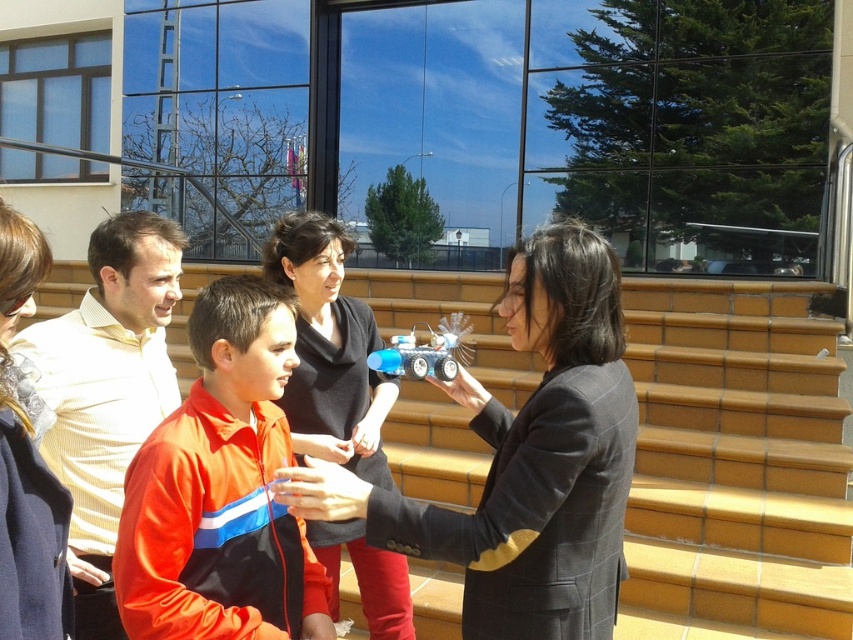
Based on the photo, you are a photographer trying to capture a photo of the yellow striped shirt at left and the black matte jacket at center. Based on their heights, which one should you focus on first if you want to ensure both are in frame without adjusting your camera angle?

The yellow striped shirt at left is shorter than the black matte jacket at center, so you should focus on the yellow striped shirt at left first to ensure both are in frame.

Looking at this image, you are a photographer standing behind the group of people in the scene. You want to take a photo of the matte black jacket at center and the yellow striped shirt at left. Which one will appear larger in your photo?

The matte black jacket at center will appear larger in the photo because it is closer to the viewer than the yellow striped shirt at left.